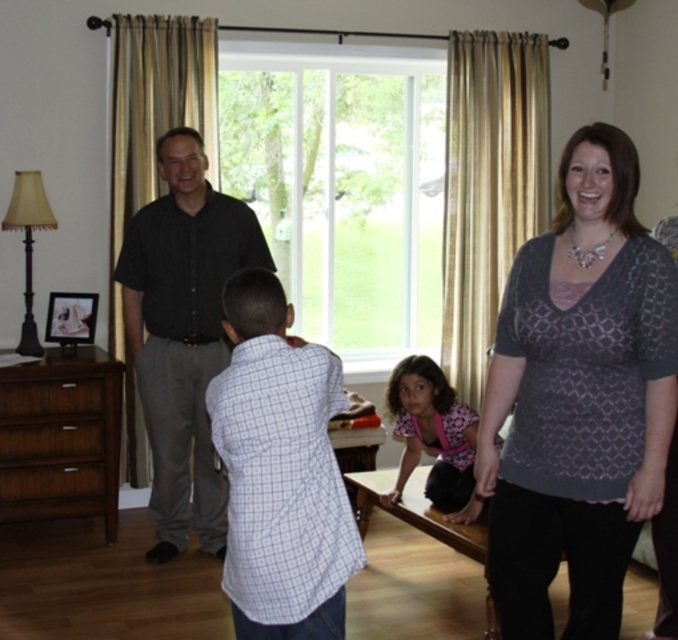
Between black smooth shirt at center and brown wood dresser at lower left, which one is positioned higher?

black smooth shirt at center is higher up.

Is black smooth shirt at center thinner than brown wood dresser at lower left?

Incorrect, black smooth shirt at center's width is not less than brown wood dresser at lower left's.

Locate an element on the screen. black smooth shirt at center is located at coordinates (182, 332).

I want to click on black smooth shirt at center, so click(x=182, y=332).

Does patterned gray blouse at right come in front of black smooth shirt at center?

Yes.

Between point (631, 308) and point (193, 372), which one is positioned behind?

The point (193, 372) is behind.

Does point (658, 333) come closer to viewer compared to point (159, 140)?

Yes, it is in front of point (159, 140).

Find the location of a particular element. This screenshot has height=640, width=678. patterned gray blouse at right is located at coordinates (578, 397).

Between black smooth shirt at center and patterned fabric blouse at center, which one appears on the left side from the viewer's perspective?

From the viewer's perspective, black smooth shirt at center appears more on the left side.

Is point (220, 493) positioned in front of point (660, 528)?

No.

The height and width of the screenshot is (640, 678). What are the coordinates of `black smooth shirt at center` in the screenshot? It's located at (182, 332).